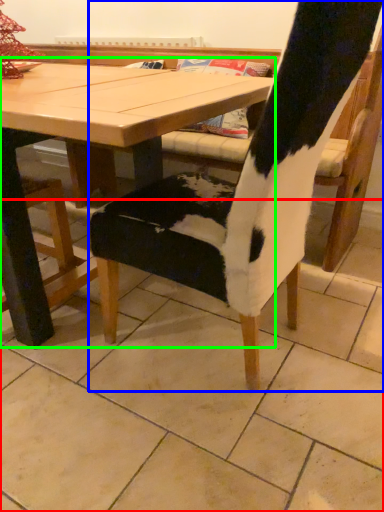
Question: Which object is positioned closest to tile (highlighted by a red box)? Select from chair (highlighted by a blue box) and table (highlighted by a green box).

Choices:
 (A) chair
 (B) table

Answer: (A)